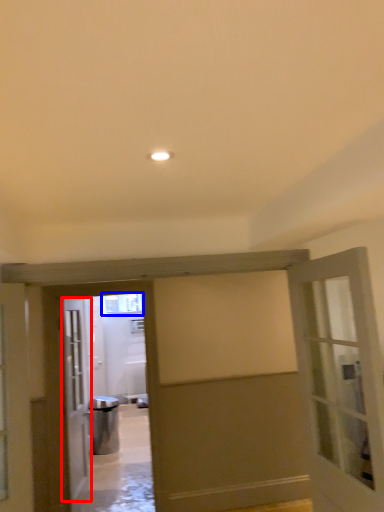
Question: Which object is closer to the camera taking this photo, door (highlighted by a red box) or window (highlighted by a blue box)?

Choices:
 (A) door
 (B) window

Answer: (A)